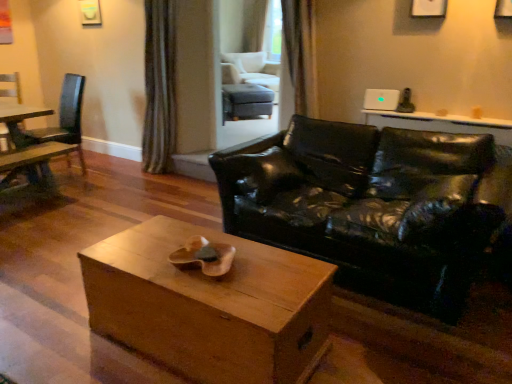
Question: Does wooden chair at left, the 3th chair in the right-to-left sequence, have a smaller size compared to green textured curtain at upper center, which is the first curtain in left-to-right order?

Choices:
 (A) yes
 (B) no

Answer: (A)

Question: Can you confirm if wooden chair at left, positioned as the 2th chair in back-to-front order, is thinner than green textured curtain at upper center, arranged as the first curtain when viewed from the back?

Choices:
 (A) no
 (B) yes

Answer: (A)

Question: Is wooden chair at left, which is counted as the second chair, starting from the front, taller than green textured curtain at upper center, the 2th curtain in the front-to-back sequence?

Choices:
 (A) yes
 (B) no

Answer: (B)

Question: Does wooden chair at left, positioned as the 2th chair in back-to-front order, appear on the left side of green textured curtain at upper center, which is the first curtain in left-to-right order?

Choices:
 (A) yes
 (B) no

Answer: (A)

Question: Are wooden chair at left, which is counted as the second chair, starting from the front, and green textured curtain at upper center, positioned as the 2th curtain in right-to-left order, far apart?

Choices:
 (A) yes
 (B) no

Answer: (A)

Question: Could green textured curtain at upper center, the 2th curtain in the front-to-back sequence, be considered to be inside wooden chair at left, which is counted as the second chair, starting from the front?

Choices:
 (A) yes
 (B) no

Answer: (B)

Question: From the image's perspective, is matte gray ottoman at center, marked as the first chair in a right-to-left arrangement, located above wooden chair at left, the 3th chair in the right-to-left sequence?

Choices:
 (A) yes
 (B) no

Answer: (A)

Question: Is matte gray ottoman at center, the 3th chair from the left, to the right of wooden chair at left, the 3th chair in the right-to-left sequence, from the viewer's perspective?

Choices:
 (A) yes
 (B) no

Answer: (A)

Question: Is matte gray ottoman at center, the 3th chair from the left, in contact with wooden chair at left, positioned as the 2th chair in back-to-front order?

Choices:
 (A) no
 (B) yes

Answer: (A)

Question: Does matte gray ottoman at center, which is the first chair in back-to-front order, have a lesser width compared to wooden chair at left, which is the first chair in left-to-right order?

Choices:
 (A) no
 (B) yes

Answer: (A)

Question: From a real-world perspective, is matte gray ottoman at center, which is the first chair in back-to-front order, physically above wooden chair at left, positioned as the 2th chair in back-to-front order?

Choices:
 (A) yes
 (B) no

Answer: (B)

Question: Is matte gray ottoman at center, marked as the first chair in a right-to-left arrangement, smaller than wooden chair at left, the 3th chair in the right-to-left sequence?

Choices:
 (A) no
 (B) yes

Answer: (A)

Question: Is green textured curtain at upper center, positioned as the 2th curtain in right-to-left order, positioned far away from wooden box at center?

Choices:
 (A) no
 (B) yes

Answer: (B)